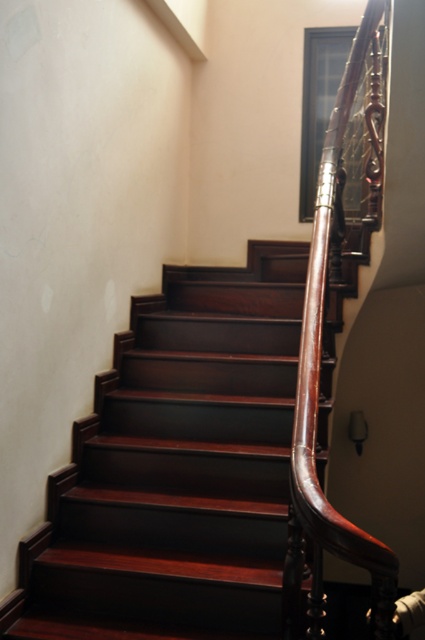
Question: Can you confirm if mahogany wood stairs at center is positioned to the left of mahogany wood handrail at upper right?

Choices:
 (A) no
 (B) yes

Answer: (B)

Question: Is mahogany wood stairs at center smaller than mahogany wood handrail at upper right?

Choices:
 (A) no
 (B) yes

Answer: (A)

Question: Does mahogany wood stairs at center come behind mahogany wood handrail at upper right?

Choices:
 (A) no
 (B) yes

Answer: (B)

Question: Among these points, which one is nearest to the camera?

Choices:
 (A) (285, 605)
 (B) (286, 456)

Answer: (A)